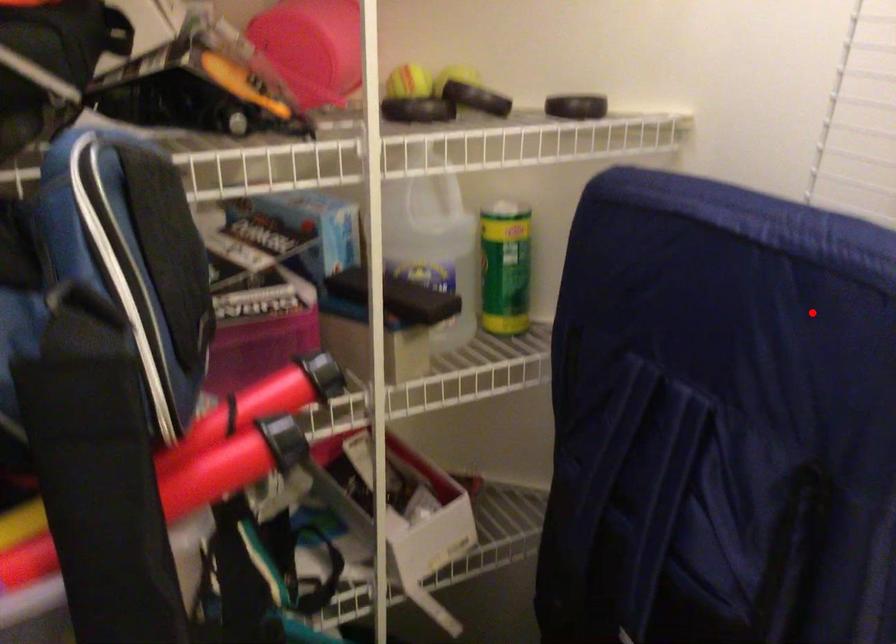
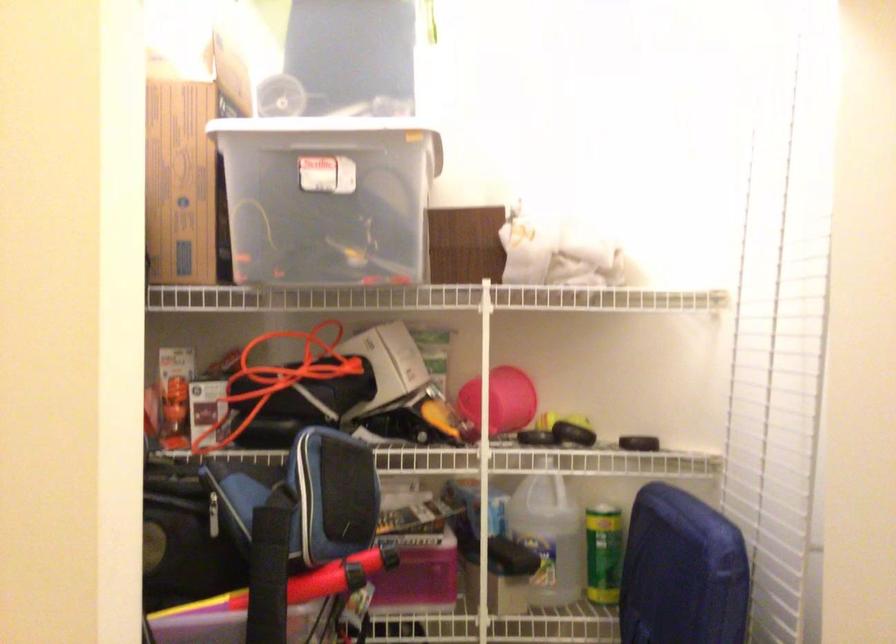
Where in the second image is the point corresponding to the highlighted location from the first image?

(682, 572)